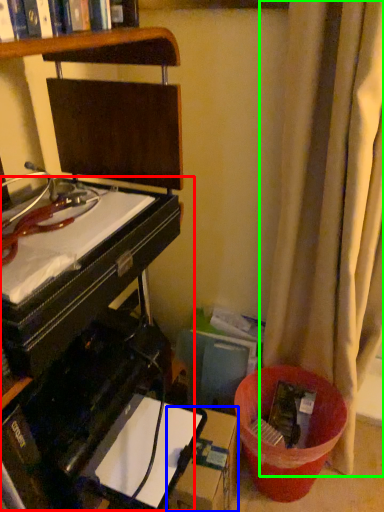
Question: Which object is the closest to the computer desk (highlighted by a red box)? Choose among these: cardboard box (highlighted by a blue box) or curtain (highlighted by a green box).

Choices:
 (A) cardboard box
 (B) curtain

Answer: (A)